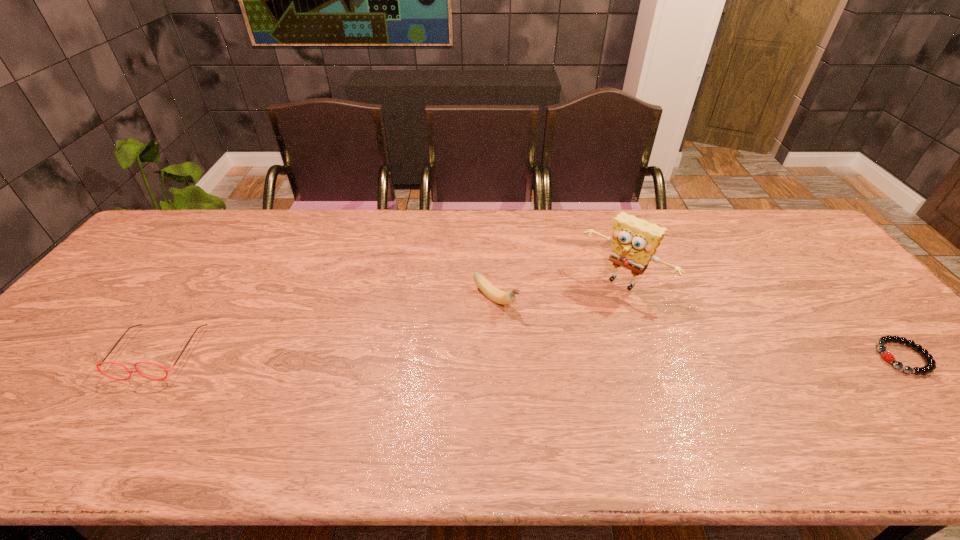
Find the location of a particular element. This screenshot has height=540, width=960. the third tallest object is located at coordinates (98, 365).

Where is `the leftmost object`? the leftmost object is located at coordinates (98, 365).

At what (x,y) coordinates should I click in order to perform the action: click on the rightmost object. Please return your answer as a coordinate pair (x, y). The image size is (960, 540). Looking at the image, I should click on (930, 365).

Identify the location of the shortest object. The width and height of the screenshot is (960, 540). (930, 365).

This screenshot has width=960, height=540. What are the coordinates of `the tallest object` in the screenshot? It's located at (634, 241).

The width and height of the screenshot is (960, 540). In order to click on the third object from left to right in this screenshot , I will do `click(634, 241)`.

Find the location of a particular element. the second tallest object is located at coordinates (498, 296).

At what (x,y) coordinates should I click in order to perform the action: click on banana. Please return your answer as a coordinate pair (x, y). Looking at the image, I should click on [498, 296].

Find the location of a particular element. The width and height of the screenshot is (960, 540). vacant space located on the front-facing side of the leftmost object is located at coordinates (123, 407).

Where is `free space located 0.140m on the left of the rightmost object`? free space located 0.140m on the left of the rightmost object is located at coordinates (823, 357).